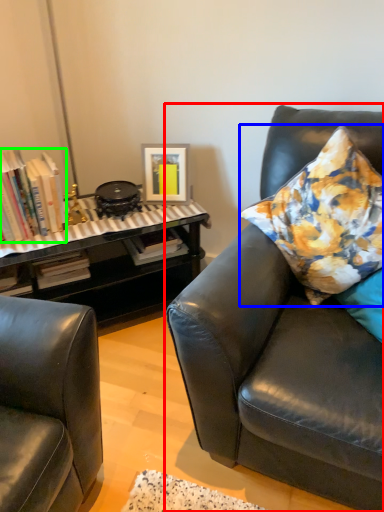
Question: Which object is positioned farthest from studio couch (highlighted by a red box)? Select from pillow (highlighted by a blue box) and book (highlighted by a green box).

Choices:
 (A) pillow
 (B) book

Answer: (B)